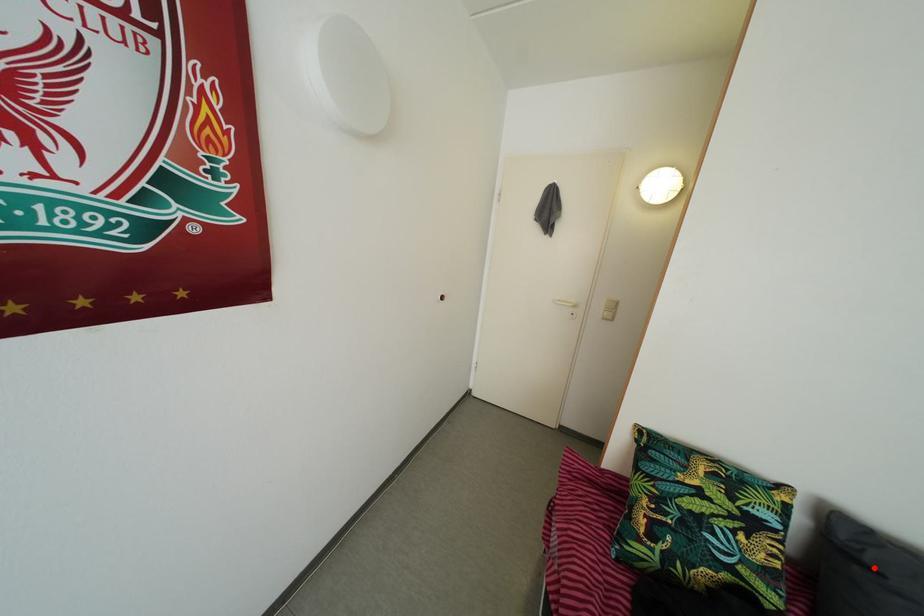
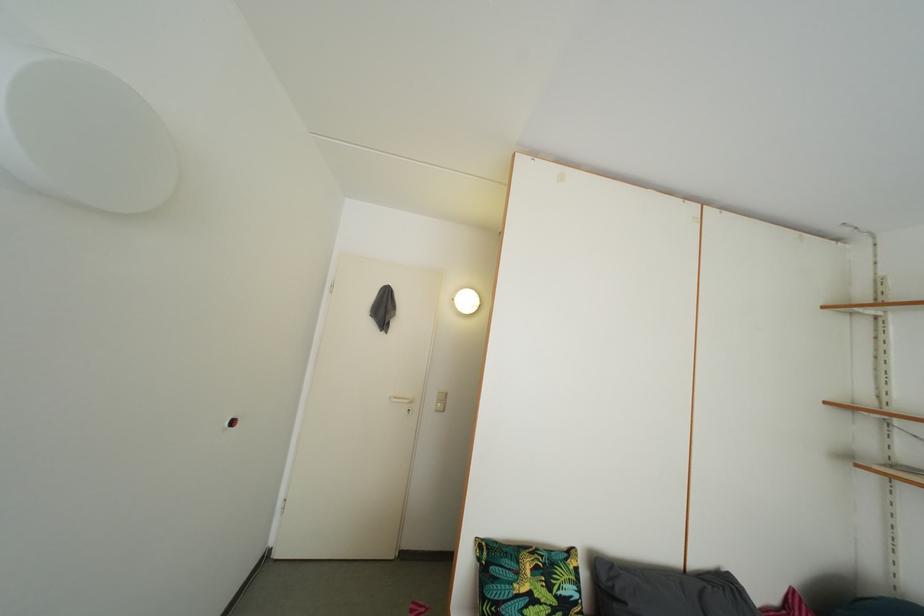
Question: I am providing you with two images of the same scene from different viewpoints. In image1, a red point is highlighted. Considering the same 3D point in image2, which of the following is correct?

Choices:
 (A) It is closer
 (B) It is farther

Answer: (B)